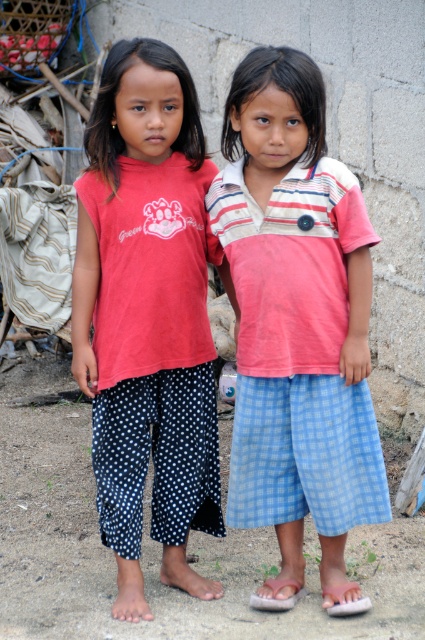
Question: Does striped cotton shirt at center lie behind brown leather sandal at lower center?

Choices:
 (A) no
 (B) yes

Answer: (A)

Question: Which of the following is the farthest from the observer?

Choices:
 (A) white rubber sandal at lower right
 (B) brown leather sandal at lower center
 (C) striped cotton shirt at center
 (D) matte red shirt at left

Answer: (B)

Question: Can you confirm if matte red shirt at left is bigger than brown leather sandal at lower center?

Choices:
 (A) yes
 (B) no

Answer: (A)

Question: Which point appears closest to the camera in this image?

Choices:
 (A) (329, 342)
 (B) (351, 605)
 (C) (282, 605)
 (D) (113, 371)

Answer: (A)

Question: Which object appears farthest from the camera in this image?

Choices:
 (A) matte red shirt at left
 (B) brown leather sandal at lower center
 (C) white rubber sandal at lower right
 (D) striped cotton shirt at center

Answer: (B)

Question: Does striped cotton shirt at center lie behind white rubber sandal at lower right?

Choices:
 (A) no
 (B) yes

Answer: (A)